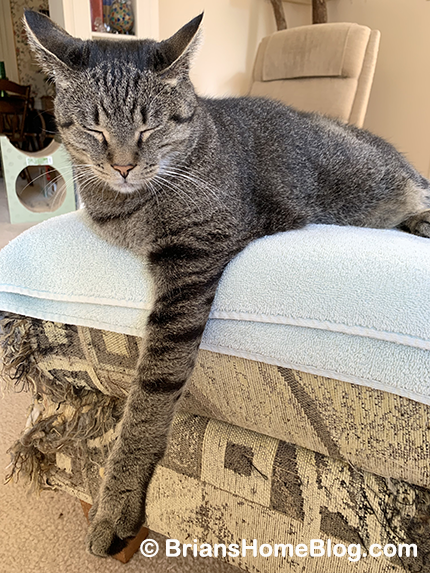
Image resolution: width=430 pixels, height=573 pixels. What are the coordinates of `blanket` in the screenshot? It's located at click(399, 327).